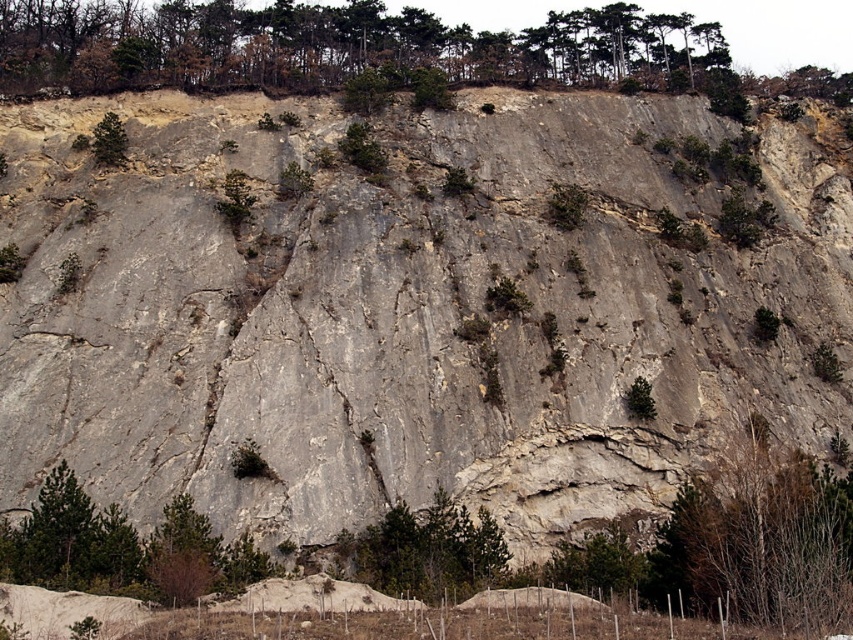
Question: Does green leafy tree at center appear on the right side of green matte tree at upper left?

Choices:
 (A) no
 (B) yes

Answer: (B)

Question: Which of the following is the closest to the observer?

Choices:
 (A) (183, 72)
 (B) (120, 154)
 (C) (354, 576)

Answer: (C)

Question: Which point is closer to the camera taking this photo?

Choices:
 (A) (115, 124)
 (B) (212, 58)

Answer: (A)

Question: Which point is closer to the camera taking this photo?

Choices:
 (A) (93, 156)
 (B) (590, 42)

Answer: (A)

Question: Where is green leafy trees at upper center located in relation to green leafy tree at center in the image?

Choices:
 (A) above
 (B) below

Answer: (A)

Question: In this image, where is green leafy trees at upper center located relative to green matte tree at upper left?

Choices:
 (A) below
 (B) above

Answer: (B)